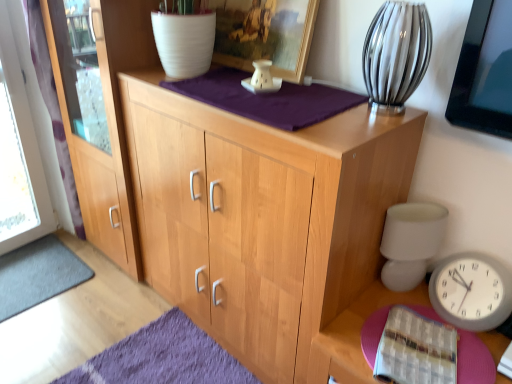
Where is `vacant point above natural wood cabinet at center (from a real-world perspective)`? vacant point above natural wood cabinet at center (from a real-world perspective) is located at coordinates coord(291,94).